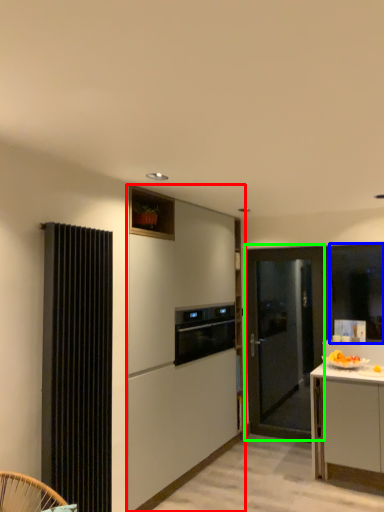
Question: Based on their relative distances, which object is nearer to cabinetry (highlighted by a red box)? Choose from window screen (highlighted by a blue box) and door (highlighted by a green box).

Choices:
 (A) window screen
 (B) door

Answer: (B)